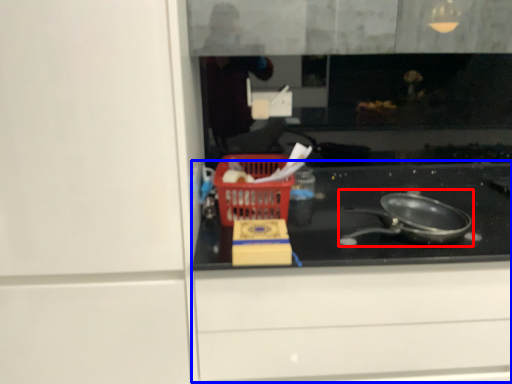
Question: Which object appears farthest to the camera in this image, frying pan (highlighted by a red box) or cabinetry (highlighted by a blue box)?

Choices:
 (A) frying pan
 (B) cabinetry

Answer: (B)